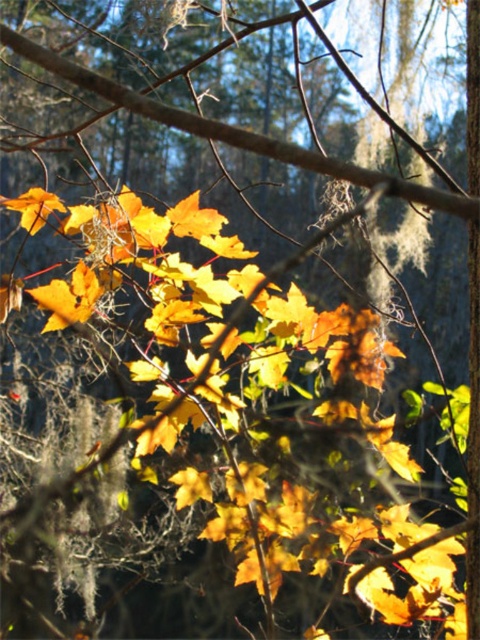
Which is below, brown matte branch at center or golden matte maple leaf at upper left?

golden matte maple leaf at upper left

Which is more to the right, brown matte branch at center or golden matte maple leaf at upper left?

From the viewer's perspective, brown matte branch at center appears more on the right side.

Describe the element at coordinates (237, 132) in the screenshot. The image size is (480, 640). I see `brown matte branch at center` at that location.

At what (x,y) coordinates should I click in order to perform the action: click on brown matte branch at center. Please return your answer as a coordinate pair (x, y). This screenshot has width=480, height=640. Looking at the image, I should click on (237, 132).

Can you confirm if matte yellow maple leaf at center is positioned above golden matte maple leaf at upper left?

No.

Between matte yellow maple leaf at center and golden matte maple leaf at upper left, which one has more height?

matte yellow maple leaf at center is taller.

The image size is (480, 640). What do you see at coordinates (69, 298) in the screenshot?
I see `matte yellow maple leaf at center` at bounding box center [69, 298].

This screenshot has width=480, height=640. What are the coordinates of `matte yellow maple leaf at center` in the screenshot? It's located at (69, 298).

Who is taller, matte yellow maple leaf at center or golden matte maple leaf at center?

Standing taller between the two is matte yellow maple leaf at center.

Image resolution: width=480 pixels, height=640 pixels. Find the location of `matte yellow maple leaf at center`. matte yellow maple leaf at center is located at coordinates (69, 298).

Locate an element on the screen. matte yellow maple leaf at center is located at coordinates click(69, 298).